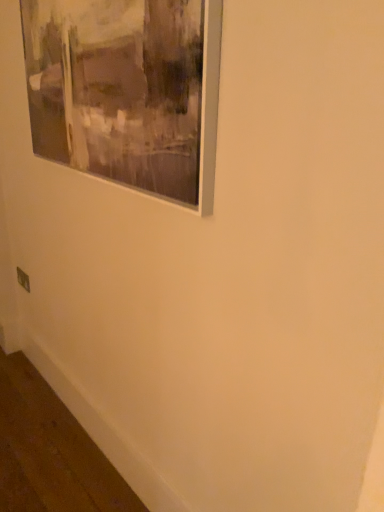
Question: From a real-world perspective, is metallic gray outlet at lower left located beneath matte gray picture frame at upper left?

Choices:
 (A) yes
 (B) no

Answer: (A)

Question: Is metallic gray outlet at lower left not within matte gray picture frame at upper left?

Choices:
 (A) no
 (B) yes

Answer: (B)

Question: Can you confirm if metallic gray outlet at lower left is positioned to the left of matte gray picture frame at upper left?

Choices:
 (A) no
 (B) yes

Answer: (B)

Question: Does metallic gray outlet at lower left appear on the right side of matte gray picture frame at upper left?

Choices:
 (A) no
 (B) yes

Answer: (A)

Question: Does metallic gray outlet at lower left touch matte gray picture frame at upper left?

Choices:
 (A) no
 (B) yes

Answer: (A)

Question: From a real-world perspective, is metallic gray outlet at lower left on matte gray picture frame at upper left?

Choices:
 (A) no
 (B) yes

Answer: (A)

Question: From a real-world perspective, is matte gray picture frame at upper left physically above metallic gray outlet at lower left?

Choices:
 (A) no
 (B) yes

Answer: (B)

Question: Are matte gray picture frame at upper left and metallic gray outlet at lower left far apart?

Choices:
 (A) no
 (B) yes

Answer: (B)

Question: Does matte gray picture frame at upper left contain metallic gray outlet at lower left?

Choices:
 (A) no
 (B) yes

Answer: (A)

Question: Does matte gray picture frame at upper left lie behind metallic gray outlet at lower left?

Choices:
 (A) yes
 (B) no

Answer: (B)

Question: Is matte gray picture frame at upper left smaller than metallic gray outlet at lower left?

Choices:
 (A) no
 (B) yes

Answer: (A)

Question: Is matte gray picture frame at upper left located outside metallic gray outlet at lower left?

Choices:
 (A) no
 (B) yes

Answer: (B)

Question: From the image's perspective, is matte gray picture frame at upper left positioned above or below metallic gray outlet at lower left?

Choices:
 (A) below
 (B) above

Answer: (B)